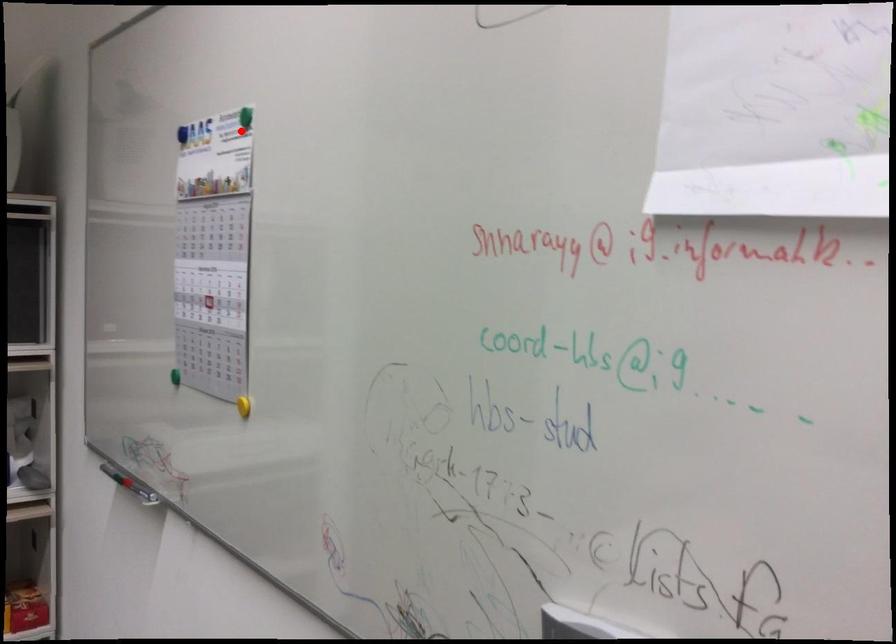
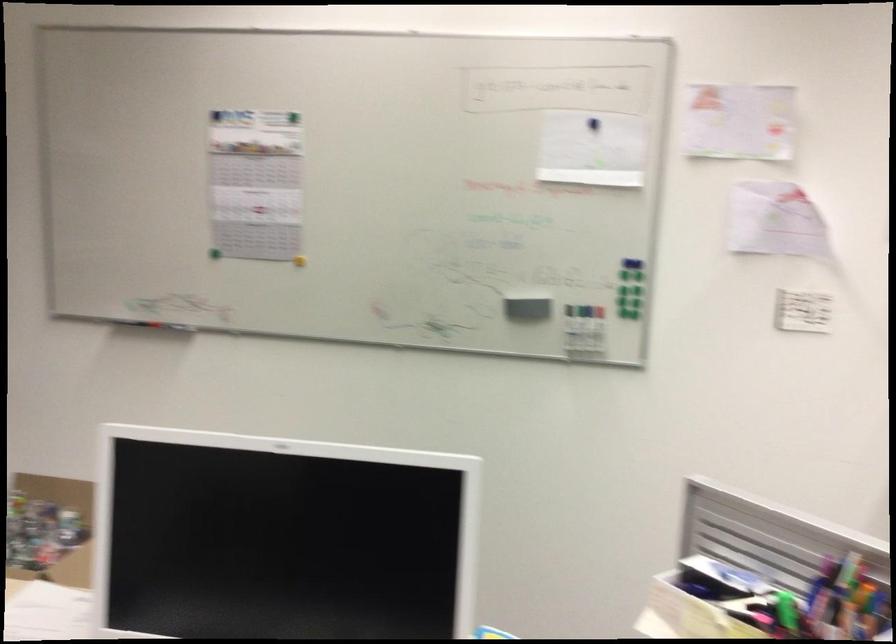
Where in the second image is the point corresponding to the highlighted location from the first image?

(293, 118)